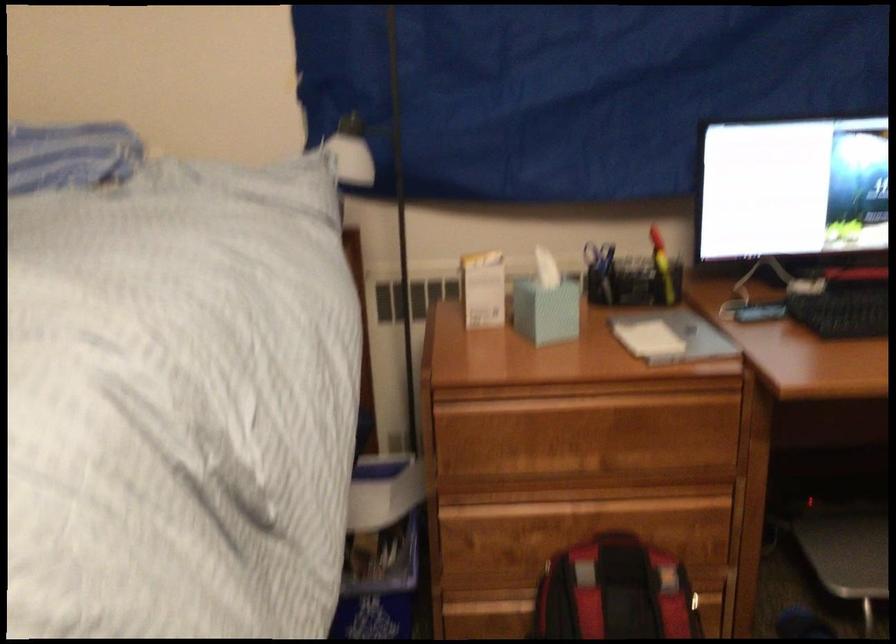
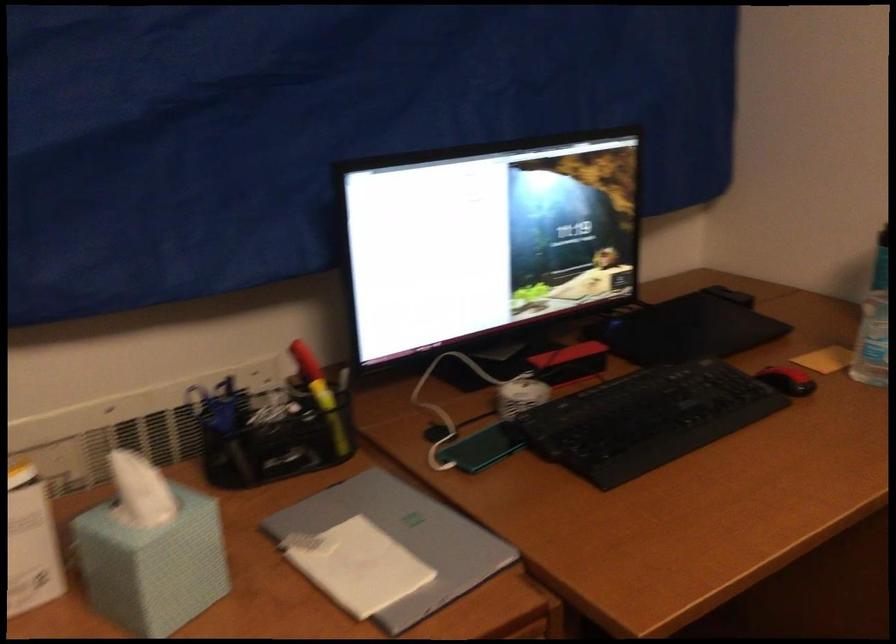
In the second image, find the point that corresponds to point (657, 263) in the first image.

(321, 395)